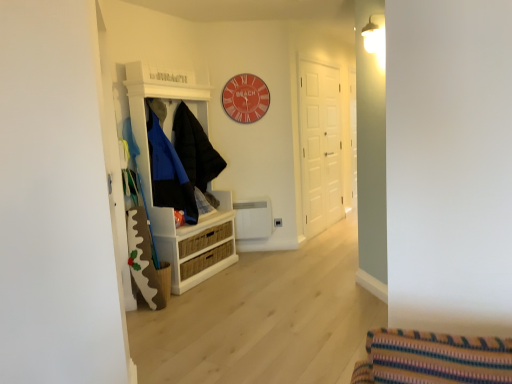
Question: Should I look upward or downward to see white wood cabinet at left?

Choices:
 (A) down
 (B) up

Answer: (B)

Question: Is black puffy jacket at center, which appears as the second clothing when viewed from the front, in contact with matte black jacket at left, the first clothing when ordered from front to back?

Choices:
 (A) yes
 (B) no

Answer: (B)

Question: From a real-world perspective, is black puffy jacket at center, which appears as the second clothing when viewed from the front, over matte black jacket at left, which ranks as the 2th clothing in back-to-front order?

Choices:
 (A) no
 (B) yes

Answer: (B)

Question: Does black puffy jacket at center, the 1th clothing positioned from the back, have a lesser height compared to matte black jacket at left, the first clothing when ordered from front to back?

Choices:
 (A) yes
 (B) no

Answer: (A)

Question: From a real-world perspective, is black puffy jacket at center, the 1th clothing positioned from the back, positioned under matte black jacket at left, which ranks as the 2th clothing in back-to-front order, based on gravity?

Choices:
 (A) yes
 (B) no

Answer: (B)

Question: Is black puffy jacket at center, the 1th clothing positioned from the back, smaller than matte black jacket at left, which ranks as the 2th clothing in back-to-front order?

Choices:
 (A) no
 (B) yes

Answer: (A)

Question: From the image's perspective, does black puffy jacket at center, which appears as the second clothing when viewed from the front, appear higher than matte black jacket at left, the first clothing when ordered from front to back?

Choices:
 (A) no
 (B) yes

Answer: (B)

Question: From the image's perspective, is white matte door at center on top of matte red clock at upper center?

Choices:
 (A) yes
 (B) no

Answer: (B)

Question: Is white matte door at center in contact with matte red clock at upper center?

Choices:
 (A) no
 (B) yes

Answer: (A)

Question: Considering the relative sizes of white matte door at center and matte red clock at upper center in the image provided, is white matte door at center thinner than matte red clock at upper center?

Choices:
 (A) yes
 (B) no

Answer: (B)

Question: From a real-world perspective, is white matte door at center positioned under matte red clock at upper center based on gravity?

Choices:
 (A) yes
 (B) no

Answer: (A)

Question: Considering the relative sizes of white matte door at center and matte red clock at upper center in the image provided, is white matte door at center shorter than matte red clock at upper center?

Choices:
 (A) no
 (B) yes

Answer: (A)

Question: From the image's perspective, is white matte door at center beneath matte red clock at upper center?

Choices:
 (A) yes
 (B) no

Answer: (A)

Question: Is white wood cabinet at left taller than white matte door at center?

Choices:
 (A) no
 (B) yes

Answer: (A)